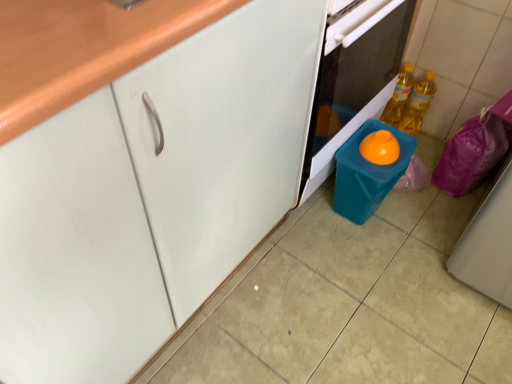
Question: Visually, is teal plastic container at lower right positioned to the left or to the right of blue plastic bin at lower center?

Choices:
 (A) left
 (B) right

Answer: (B)

Question: Is teal plastic container at lower right taller or shorter than blue plastic bin at lower center?

Choices:
 (A) short
 (B) tall

Answer: (A)

Question: Which is farther from the teal plastic container at lower right?

Choices:
 (A) yellow translucent bottle at right, acting as the first bottle starting from the left
 (B) blue plastic bin at lower center
 (C) translucent yellow bottle at right, arranged as the 1th bottle when viewed from the right
 (D) white matte cabinet at center

Answer: (D)

Question: Which is farther from the white matte cabinet at center?

Choices:
 (A) translucent yellow bottle at right, arranged as the 1th bottle when viewed from the right
 (B) blue plastic bin at lower center
 (C) yellow translucent bottle at right, positioned as the second bottle in right-to-left order
 (D) teal plastic container at lower right

Answer: (A)